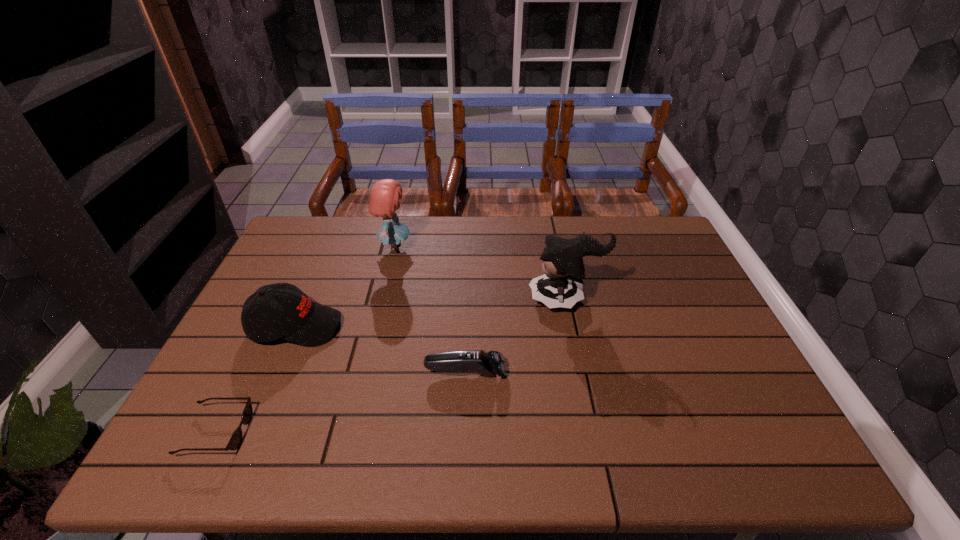
Image resolution: width=960 pixels, height=540 pixels. I want to click on blank space located at the face of the nearer doll, so coord(481,299).

Where is `vacant space located at the face of the nearer doll`? vacant space located at the face of the nearer doll is located at coordinates (457, 299).

In order to click on free location located at the face of the nearer doll in this screenshot , I will do `click(450, 299)`.

Locate an element on the screen. This screenshot has width=960, height=540. free space located on the front-facing side of the baseball cap is located at coordinates (389, 326).

At what (x,y) coordinates should I click in order to perform the action: click on vacant space located on the head of the electric shaver. Please return your answer as a coordinate pair (x, y). The width and height of the screenshot is (960, 540). Looking at the image, I should click on (557, 372).

Where is `free space located 0.080m on the front lenses of the nearest object`? free space located 0.080m on the front lenses of the nearest object is located at coordinates (282, 432).

I want to click on object that is positioned at the far edge, so click(384, 198).

You are a GUI agent. You are given a task and a screenshot of the screen. Output one action in this format:
    pyautogui.click(x=<x>, y=<y>)
    Task: Click on the object situated at the near edge
    The image size is (960, 540).
    Given the screenshot: What is the action you would take?
    pyautogui.click(x=236, y=438)

You are a GUI agent. You are given a task and a screenshot of the screen. Output one action in this format:
    pyautogui.click(x=<x>, y=<y>)
    Task: Click on the baseball cap that is positioned at the left edge
    Image resolution: width=960 pixels, height=540 pixels.
    Given the screenshot: What is the action you would take?
    pyautogui.click(x=302, y=321)

Locate an element on the screen. sunglasses located at the left edge is located at coordinates (236, 438).